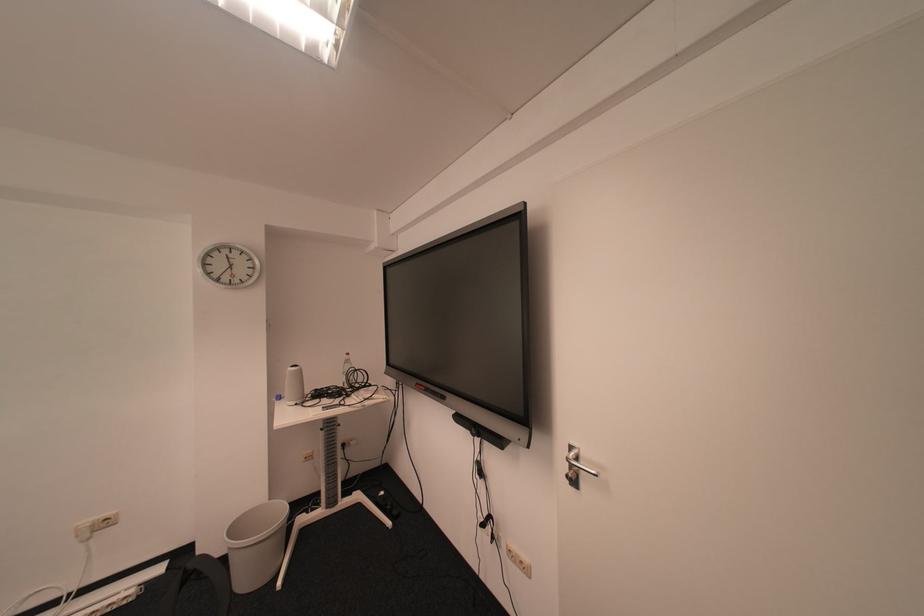
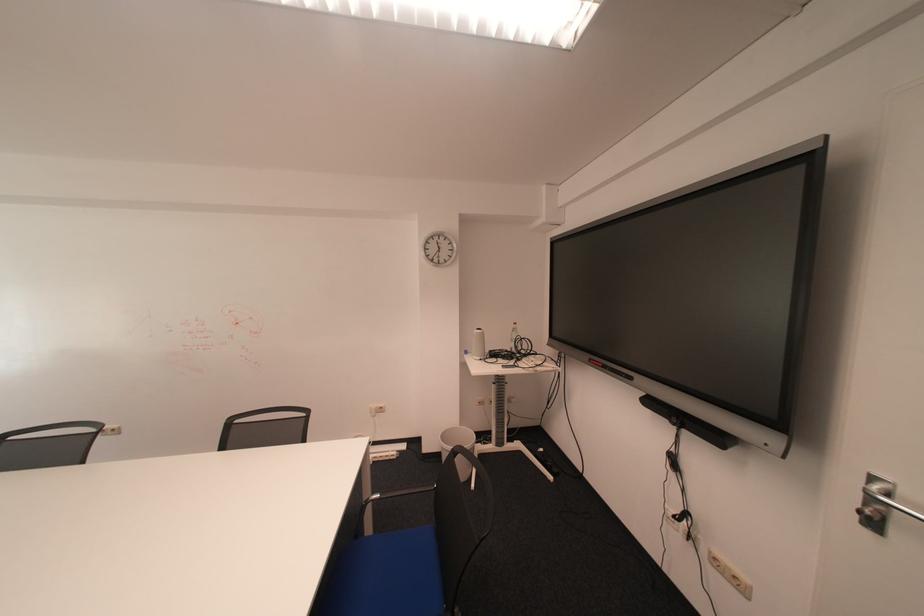
Locate, in the second image, the point that corresponds to pixel 246 528 in the first image.

(456, 437)